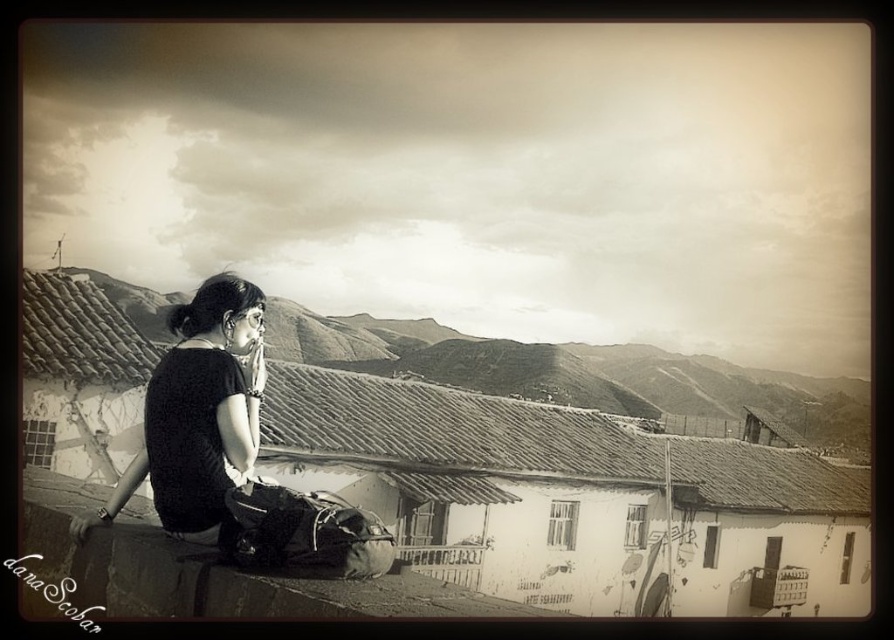
You are standing at the edge of the scene and want to sit down. Is the smooth concrete ledge at lower left available for sitting?

The smooth concrete ledge at lower left is located at point (106, 548), so yes, it is available for sitting as it is a flat surface.

You are a photographer trying to capture the woman in the scene. You notice the black matte shirt at center and the matte black backpack at lower center. Which object is closer to the left side of the frame?

The black matte shirt at center is positioned on the left side of the matte black backpack at lower center, so the black matte shirt at center is closer to the left side of the frame.